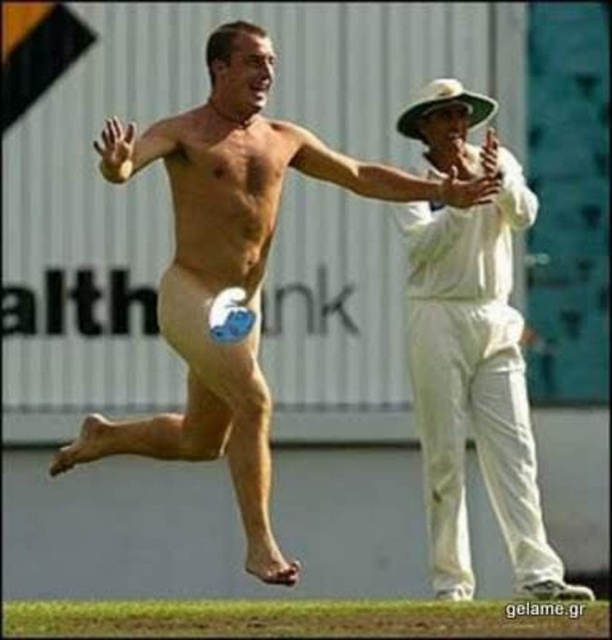
You are a photographer standing at the camera position. You want to take a photo focusing on both the shirtless person and the cricket player. Which of the two points, point [218,212] or point [512,417], is closer to your camera position?

Point [218,212] is closer to the camera than point [512,417].

You are a photographer trying to capture both the skinny nude man at center and the white cotton cricket uniform at right in a single frame. Which subject should you focus on first to ensure they both fit in the photo?

The skinny nude man at center occupies less space than the white cotton cricket uniform at right, so you should focus on positioning the white cotton cricket uniform at right first to ensure both subjects fit in the frame.

You are a photographer standing at the edge of the cricket field. You need to take a photo that includes both the skinny nude man at center and the white cotton cricket uniform at right. Based on their positions, which one should be on the left side of the photo?

The skinny nude man at center should be on the left side of the photo because he is positioned to the left of the white cotton cricket uniform at right.